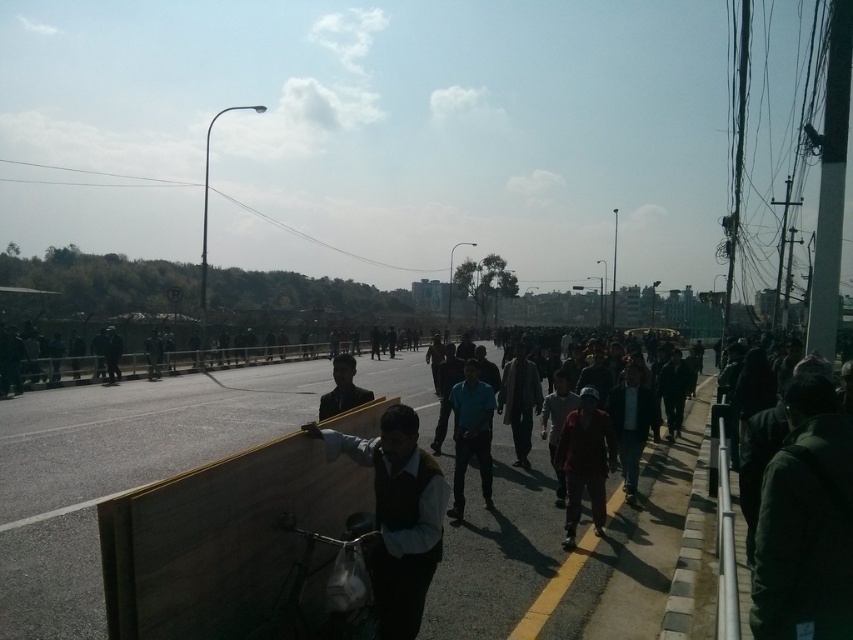
Who is shorter, dark green jacket at lower right or blue matte shirt at center?

With less height is dark green jacket at lower right.

Does point (827, 568) come in front of point (480, 477)?

That is True.

Where is `dark green jacket at lower right`? This screenshot has width=853, height=640. dark green jacket at lower right is located at coordinates (805, 522).

Is blue matte shirt at center taller than dark blue shirt at center?

In fact, blue matte shirt at center may be shorter than dark blue shirt at center.

You are a GUI agent. You are given a task and a screenshot of the screen. Output one action in this format:
    pyautogui.click(x=<x>, y=<y>)
    Task: Click on the blue matte shirt at center
    This screenshot has width=853, height=640.
    Given the screenshot: What is the action you would take?
    pyautogui.click(x=471, y=435)

Describe the element at coordinates (471, 435) in the screenshot. This screenshot has height=640, width=853. I see `blue matte shirt at center` at that location.

Where is `blue matte shirt at center`? blue matte shirt at center is located at coordinates (471, 435).

Looking at this image, between wooden plank at center and dark green vest at center, which one appears on the left side from the viewer's perspective?

wooden plank at center

Find the location of a particular element. wooden plank at center is located at coordinates (224, 544).

Image resolution: width=853 pixels, height=640 pixels. In order to click on wooden plank at center in this screenshot , I will do `click(224, 544)`.